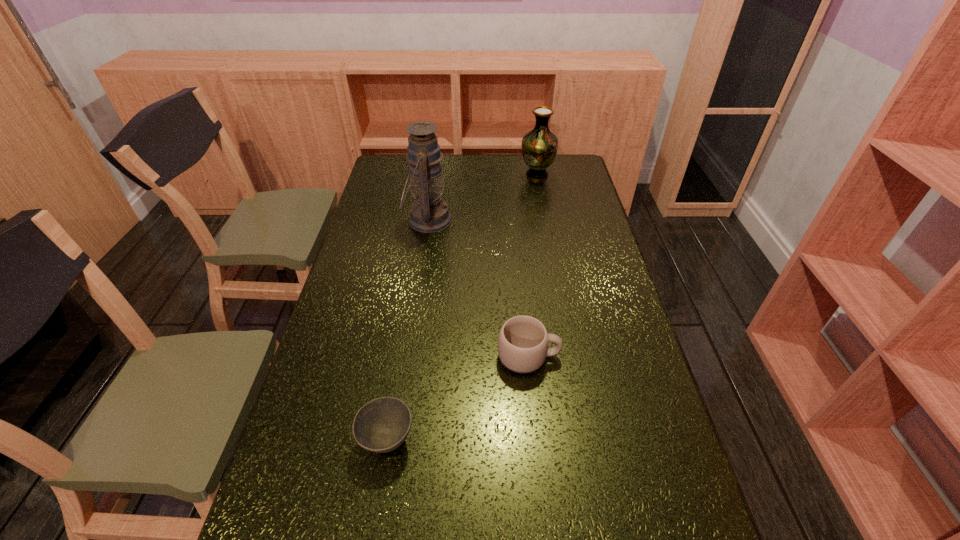
Where is `free location located on the side of the second nearest object with the handle`? free location located on the side of the second nearest object with the handle is located at coordinates (644, 356).

I want to click on vacant space located on the right of the bowl, so click(501, 440).

Find the location of a particular element. object present at the far edge is located at coordinates (539, 147).

Locate an element on the screen. This screenshot has width=960, height=540. object located in the left edge section of the desktop is located at coordinates 429,213.

Where is `object that is at the right edge`? object that is at the right edge is located at coordinates (x=539, y=147).

Where is `object located in the far right corner section of the desktop`? The image size is (960, 540). object located in the far right corner section of the desktop is located at coordinates (539, 147).

The image size is (960, 540). I want to click on free region at the far edge of the desktop, so click(494, 181).

Where is `free space at the left edge`? Image resolution: width=960 pixels, height=540 pixels. free space at the left edge is located at coordinates (291, 492).

This screenshot has width=960, height=540. What are the coordinates of `free spot at the right edge of the desktop` in the screenshot? It's located at (595, 269).

Find the location of `vacant space at the far left corner of the desktop`. vacant space at the far left corner of the desktop is located at coordinates (404, 159).